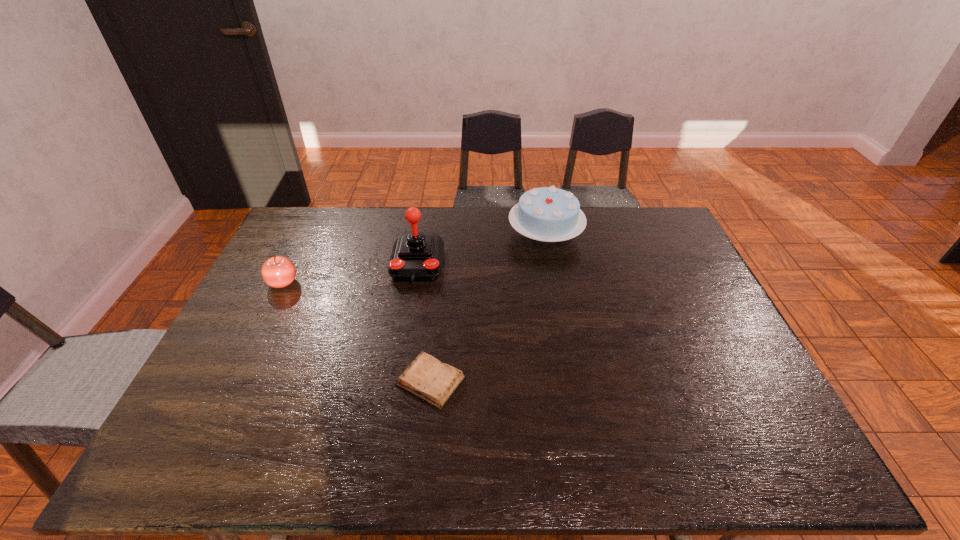
The image size is (960, 540). In order to click on vacant space at the far right corner of the desktop in this screenshot , I will do `click(645, 228)`.

Where is `vacant space that's between the apple and the joystick`? vacant space that's between the apple and the joystick is located at coordinates (350, 273).

Where is `vacant space that's between the shortest object and the third shortest object`? vacant space that's between the shortest object and the third shortest object is located at coordinates (488, 308).

Where is `vacant space that's between the tallest object and the diary`? The image size is (960, 540). vacant space that's between the tallest object and the diary is located at coordinates (424, 322).

Where is `vacant area that lies between the joystick and the second shortest object`? vacant area that lies between the joystick and the second shortest object is located at coordinates (350, 273).

This screenshot has height=540, width=960. Find the location of `vacant space that is in between the tallest object and the second tallest object`. vacant space that is in between the tallest object and the second tallest object is located at coordinates (482, 249).

At what (x,y) coordinates should I click in order to perform the action: click on vacant space that is in between the second tallest object and the nearest object. Please return your answer as a coordinate pair (x, y). This screenshot has height=540, width=960. Looking at the image, I should click on (488, 308).

Where is `blank region between the joystick and the nearest object`? The height and width of the screenshot is (540, 960). blank region between the joystick and the nearest object is located at coordinates (424, 322).

Locate an element on the screen. empty space that is in between the tallest object and the rightmost object is located at coordinates (482, 249).

At what (x,y) coordinates should I click in order to perform the action: click on free area in between the tallest object and the birthday cake. Please return your answer as a coordinate pair (x, y). Looking at the image, I should click on (482, 249).